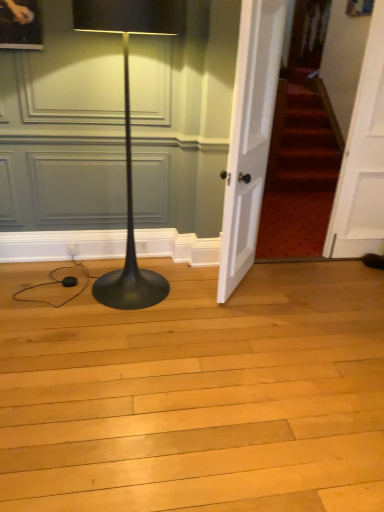
What are the coordinates of `vacant space to the right of black glossy floor lamp at left` in the screenshot? It's located at (198, 308).